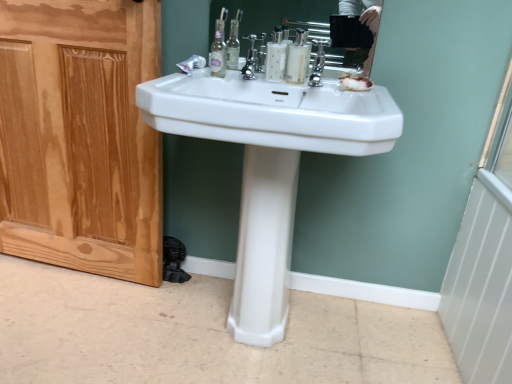
Locate an element on the screen. unoccupied region to the right of natural wood screen door at left is located at coordinates (165, 316).